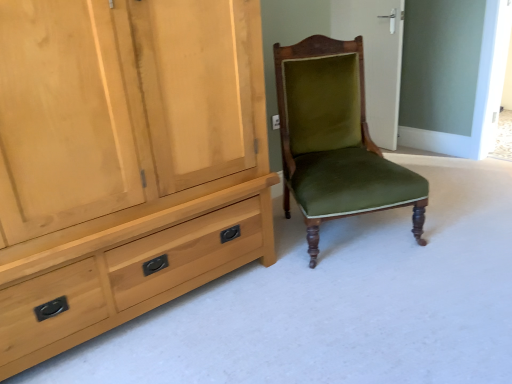
Question: From a real-world perspective, is light wood cabinet at left above or below velvet green chair at center?

Choices:
 (A) above
 (B) below

Answer: (A)

Question: In terms of height, does light wood cabinet at left look taller or shorter compared to velvet green chair at center?

Choices:
 (A) short
 (B) tall

Answer: (B)

Question: Estimate the real-world distances between objects in this image. Which object is closer to the light wood cabinet at left?

Choices:
 (A) green velvet chair at center
 (B) velvet green chair at center

Answer: (B)

Question: Which object is positioned farthest from the light wood cabinet at left?

Choices:
 (A) green velvet chair at center
 (B) velvet green chair at center

Answer: (A)